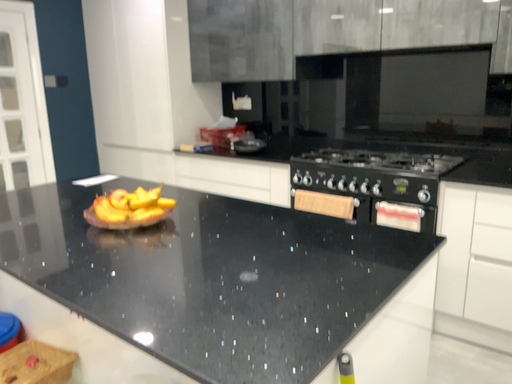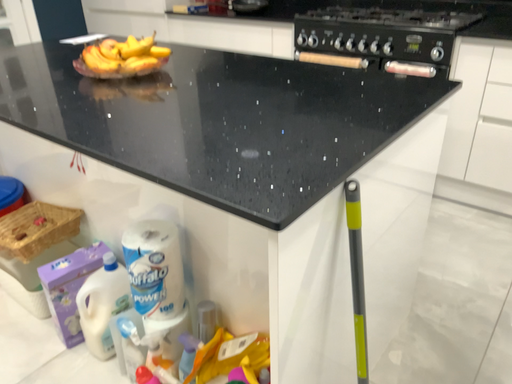
Question: Which way did the camera rotate in the video?

Choices:
 (A) rotated downward
 (B) rotated upward

Answer: (A)